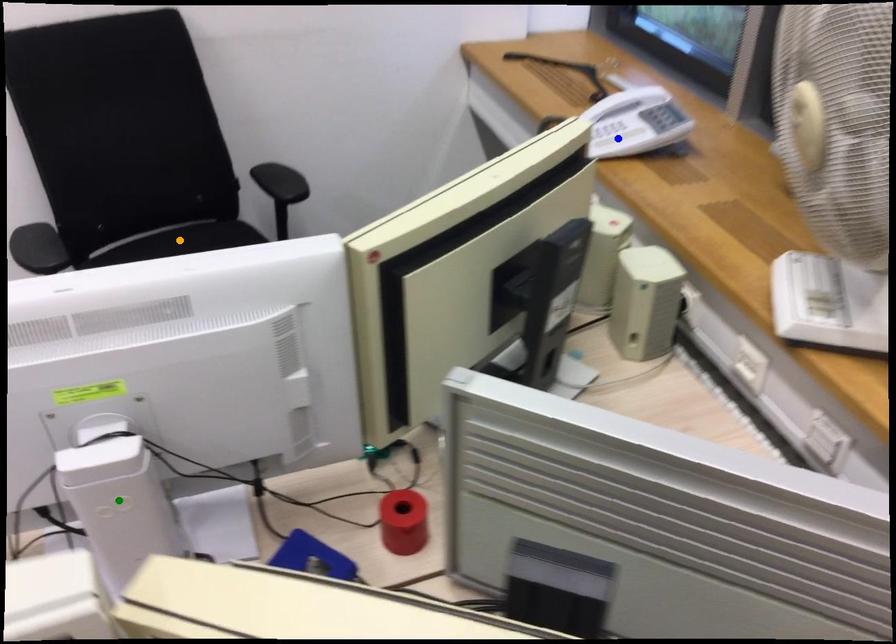
Order these from nearest to farthest:
orange point, green point, blue point

green point
blue point
orange point